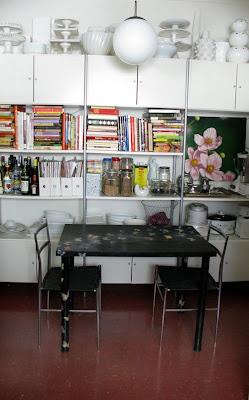
The height and width of the screenshot is (400, 249). I want to click on light fixture from ceiling, so click(133, 42).